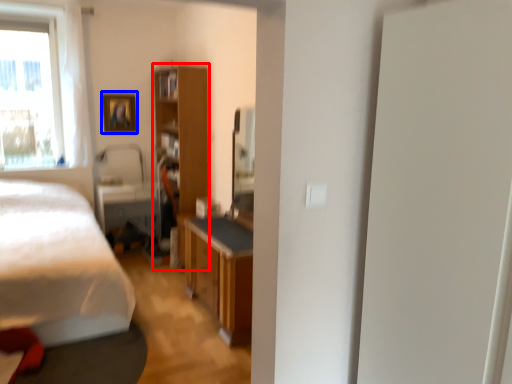
Question: Which of the following is the closest to the observer, cabinetry (highlighted by a red box) or picture frame (highlighted by a blue box)?

Choices:
 (A) cabinetry
 (B) picture frame

Answer: (A)